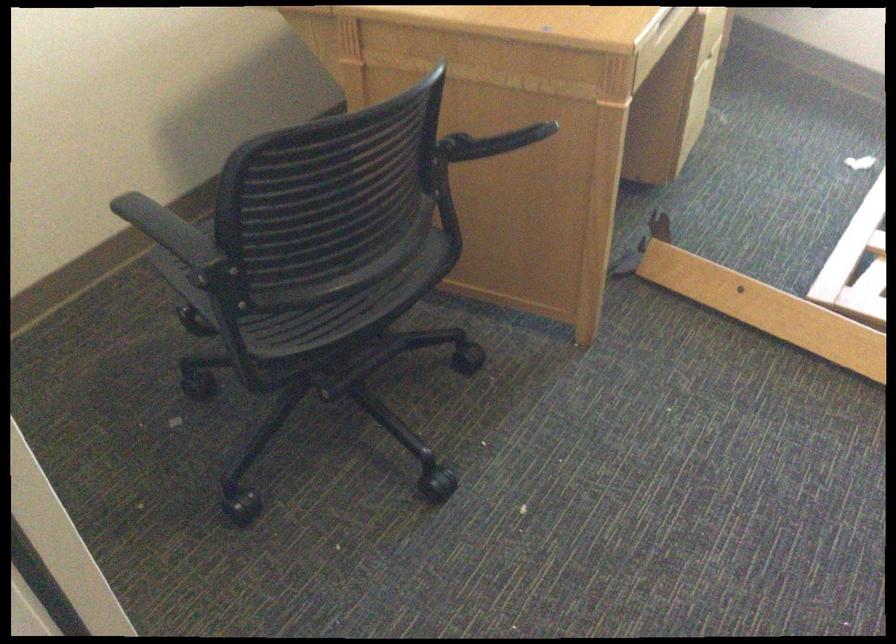
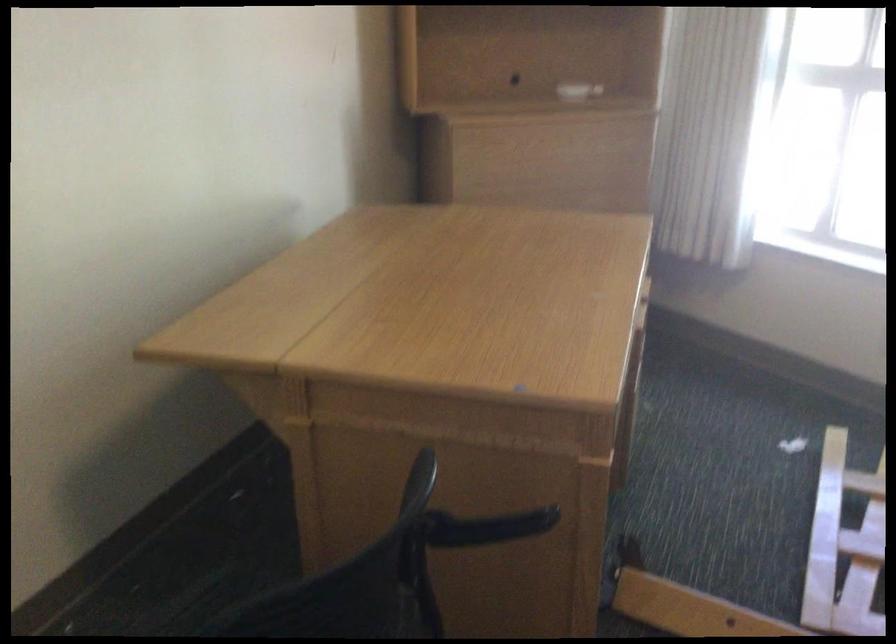
Question: The first image is from the beginning of the video and the second image is from the end. How did the camera likely rotate when shooting the video?

Choices:
 (A) Left
 (B) Right
 (C) Up
 (D) Down

Answer: (C)